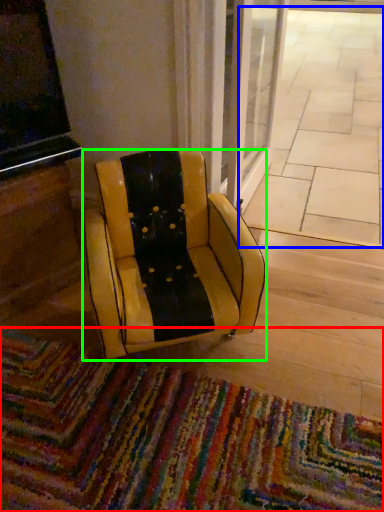
Question: Based on their relative distances, which object is farther from mat (highlighted by a red box)? Choose from pavement (highlighted by a blue box) and chair (highlighted by a green box).

Choices:
 (A) pavement
 (B) chair

Answer: (A)